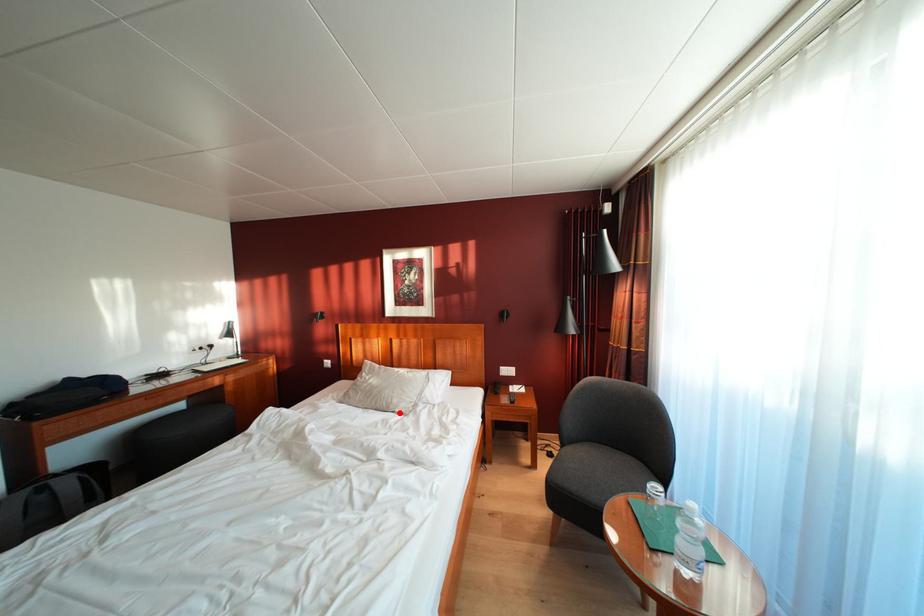
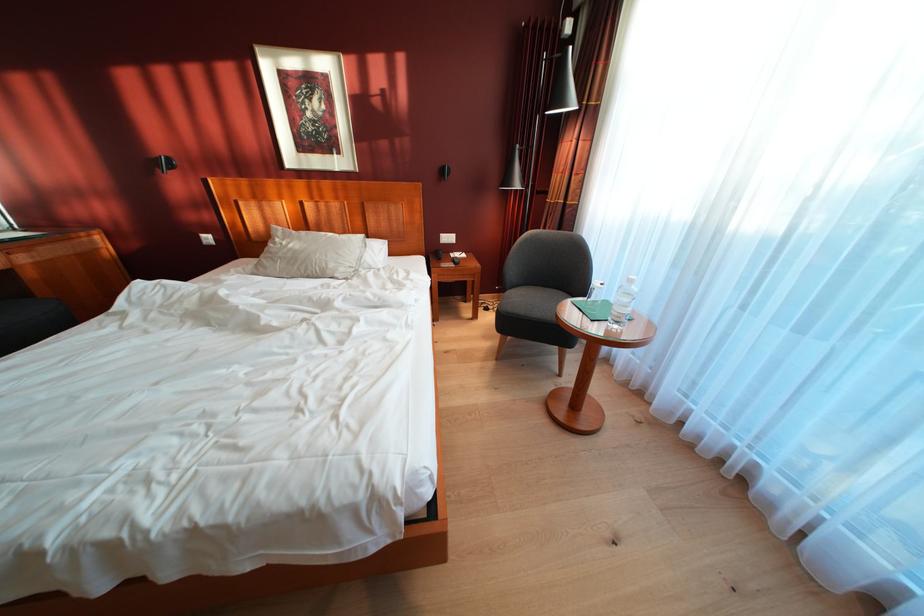
Question: A red point is marked in image1. In image2, is the corresponding 3D point closer to the camera or farther? Reply with the corresponding letter.

Choices:
 (A) The corresponding 3D point is closer.
 (B) The corresponding 3D point is farther.

Answer: (A)